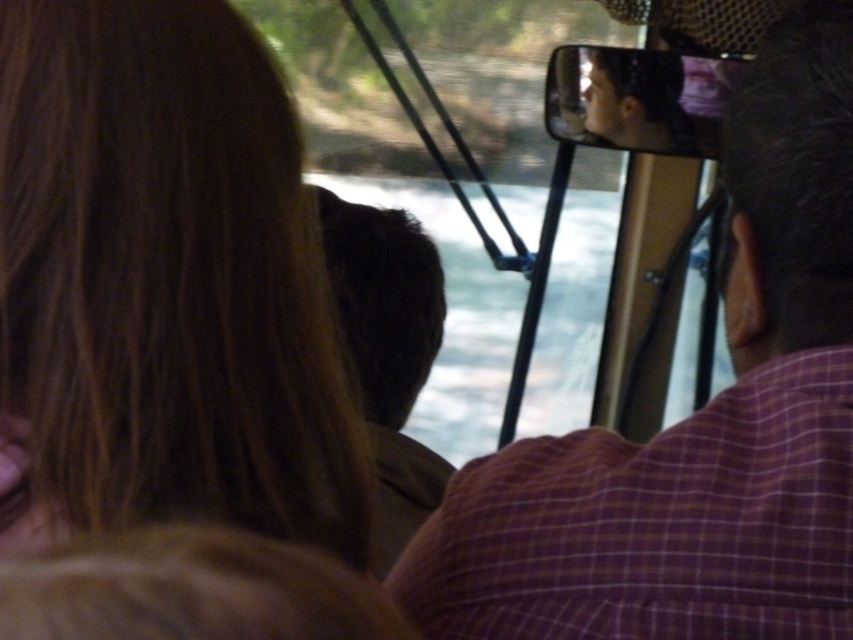
You are a passenger in the vehicle and want to take a photo of the landscape outside through the windshield. However, you notice two people blocking your view. Which person, the blonde hair at left or the brown hair at center, is closer to you and thus more obstructing your view?

The blonde hair at left is in front of brown hair at center, so the blonde hair at left is closer to you and more obstructing your view.

From the picture: You are a photographer trying to capture a group photo of the passengers in the vehicle. The camera you have can only focus on objects within a 10 inch range. Given the distance between the blonde hair at left and the purple checkered shirt at upper right, will your camera be able to focus on both subjects simultaneously?

The distance between the blonde hair at left and the purple checkered shirt at upper right is 9.09 inches, which is within the camera focus range of 10 inches. Therefore, the camera can focus on both subjects simultaneously.

You are a photographer trying to capture a group photo of the passengers in the vehicle. Given that the blonde hair at left is narrower than the purple checkered shirt at upper right, which object would require more space in the frame to ensure it is fully visible?

The purple checkered shirt at upper right requires more space in the frame because its width is greater than the blonde hair at left.